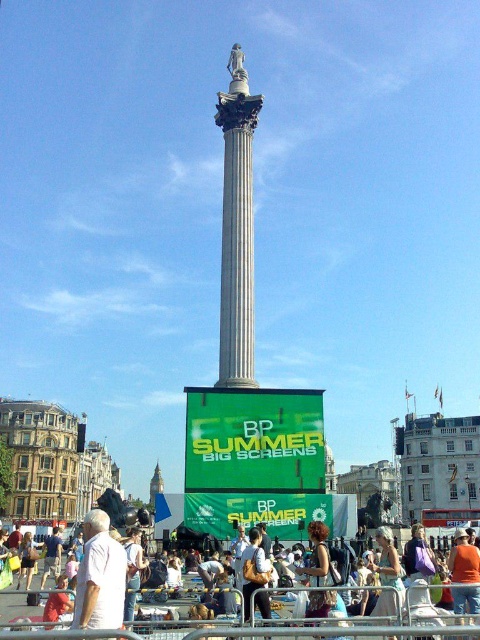
Is white marble column at center to the left of orange fabric shirt at center from the viewer's perspective?

Correct, you'll find white marble column at center to the left of orange fabric shirt at center.

Can you confirm if white marble column at center is positioned to the right of orange fabric shirt at center?

In fact, white marble column at center is to the left of orange fabric shirt at center.

In the scene shown: Measure the distance between point (240, 381) and camera.

They are 68.29 meters apart.

Where is `white marble column at center`? white marble column at center is located at coordinates (237, 227).

Between white marble column at center and white cotton shirt at lower left, which one has more height?

With more height is white marble column at center.

Is white marble column at center positioned behind white cotton shirt at lower left?

That is True.

Is point (248, 122) behind point (104, 618)?

Yes, it is behind point (104, 618).

Identify the location of white marble column at center. The width and height of the screenshot is (480, 640). point(237,227).

Who is more forward, (111,628) or (472,604)?

Point (111,628)

Is white cotton shirt at lower center wider than orange fabric shirt at center?

Yes, white cotton shirt at lower center is wider than orange fabric shirt at center.

Find the location of `white cotton shirt at lower center`. white cotton shirt at lower center is located at coordinates (93, 588).